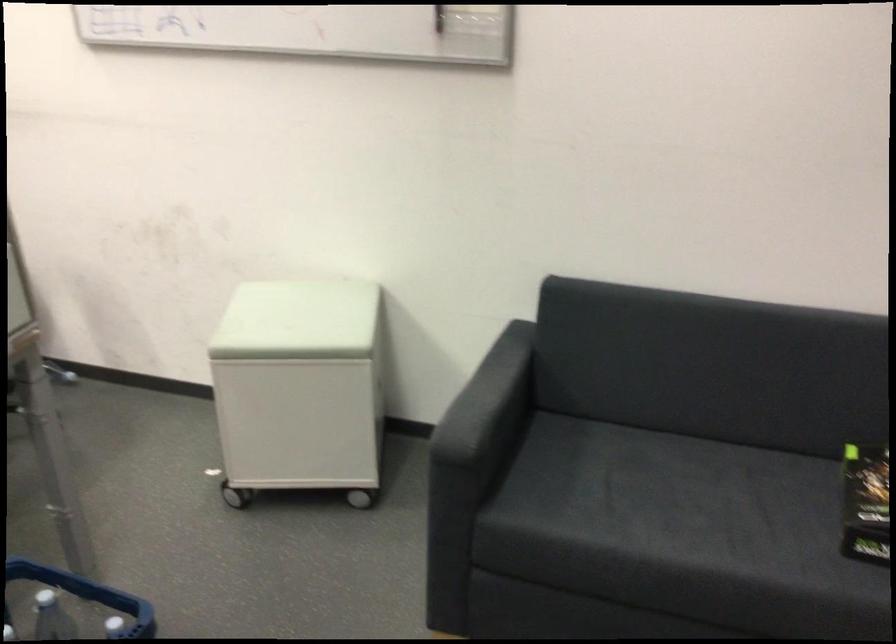
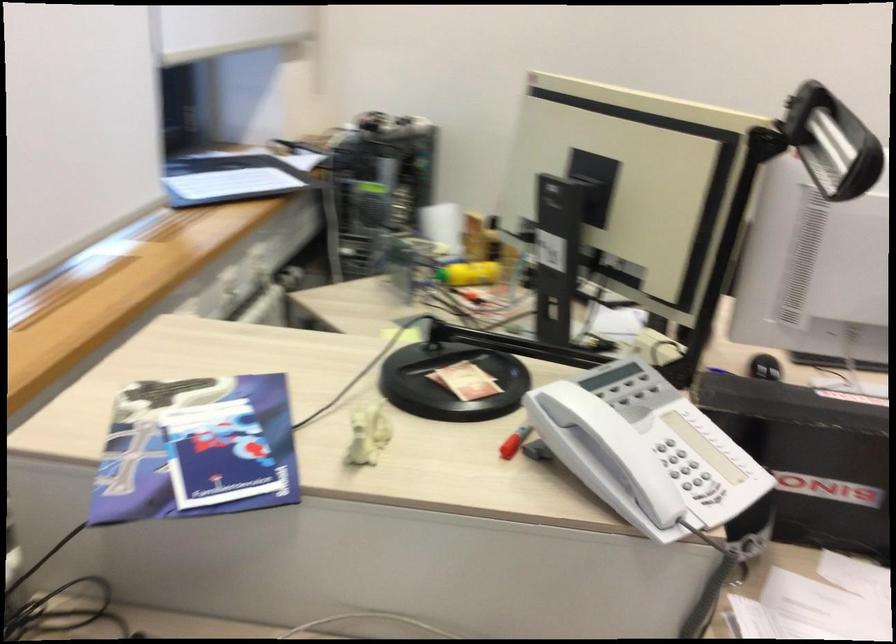
Question: The images are taken continuously from a first-person perspective. In which direction are you moving?

Choices:
 (A) Left
 (B) Right
 (C) Forward
 (D) Backward

Answer: (A)